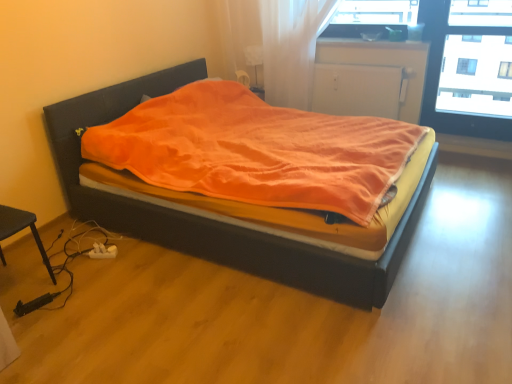
Identify the location of vacant area that lies in front of velvet orange blanket at center. Image resolution: width=512 pixels, height=384 pixels. (259, 320).